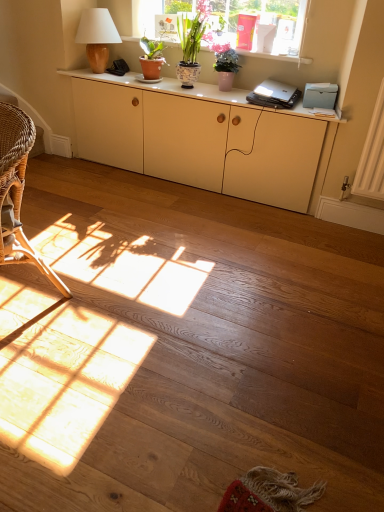
Find the location of a particular element. This screenshot has height=512, width=384. vacant area located to the right-hand side of woven rattan chair at left is located at coordinates (115, 320).